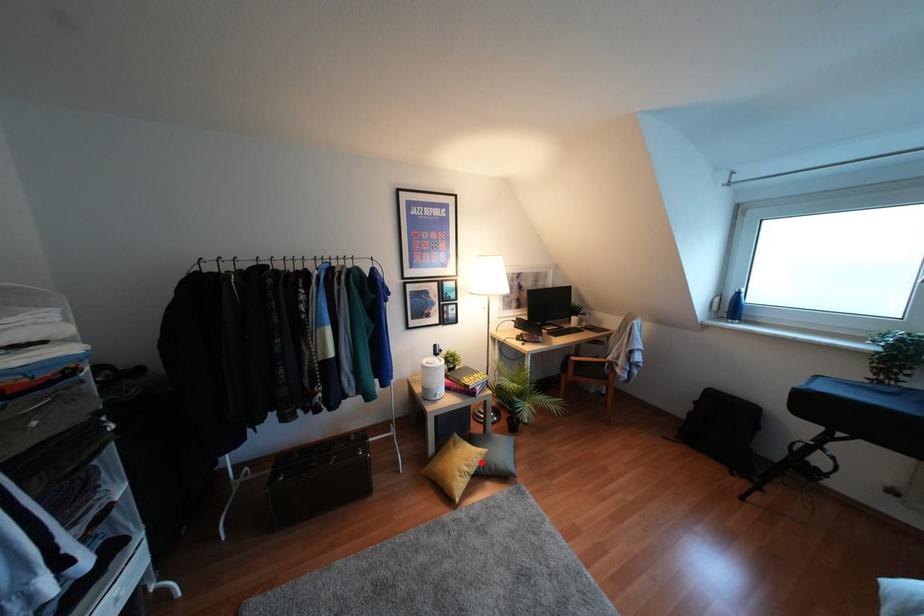
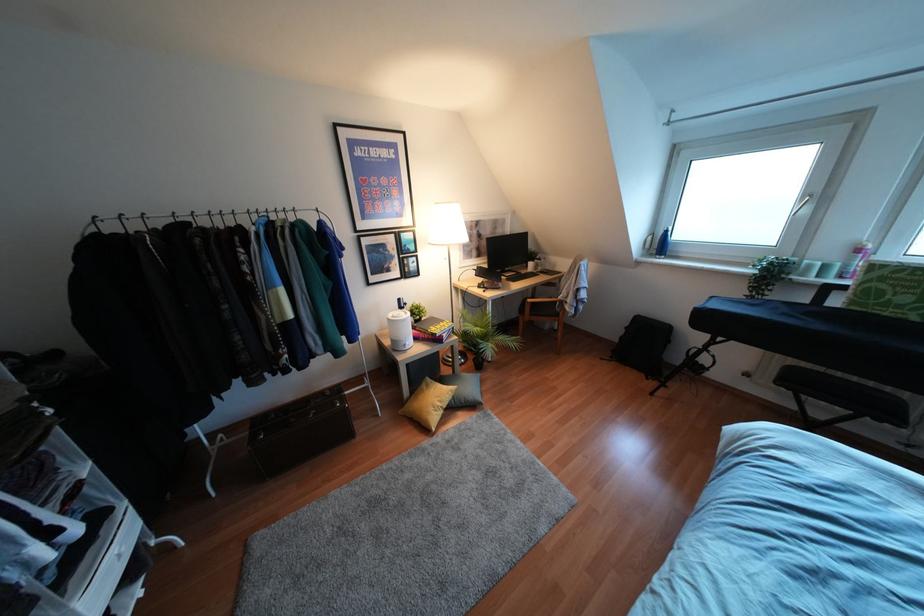
Find the pixel in the second image that matches the highlighted location in the first image.

(453, 397)